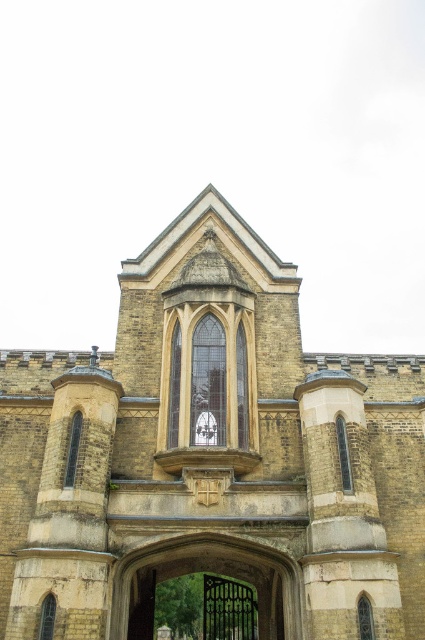
Question: Does yellow stone church at center appear on the right side of black wrought iron gate at center?

Choices:
 (A) no
 (B) yes

Answer: (B)

Question: Which of the following is the farthest from the observer?

Choices:
 (A) black wrought iron gate at center
 (B) yellow stone church at center

Answer: (A)

Question: Which point appears closest to the camera in this image?

Choices:
 (A) (254, 584)
 (B) (102, 602)

Answer: (B)

Question: Which point appears farthest from the camera in this image?

Choices:
 (A) (172, 419)
 (B) (232, 561)

Answer: (B)

Question: Observing the image, what is the correct spatial positioning of yellow stone church at center in reference to black wrought iron gate at center?

Choices:
 (A) left
 (B) right

Answer: (B)

Question: Does yellow stone church at center have a smaller size compared to black wrought iron gate at center?

Choices:
 (A) yes
 (B) no

Answer: (B)